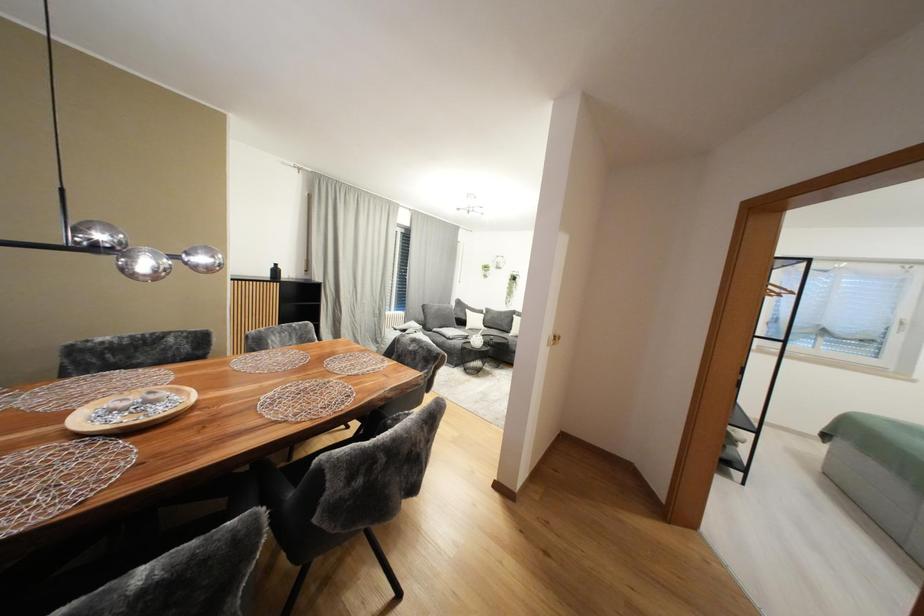
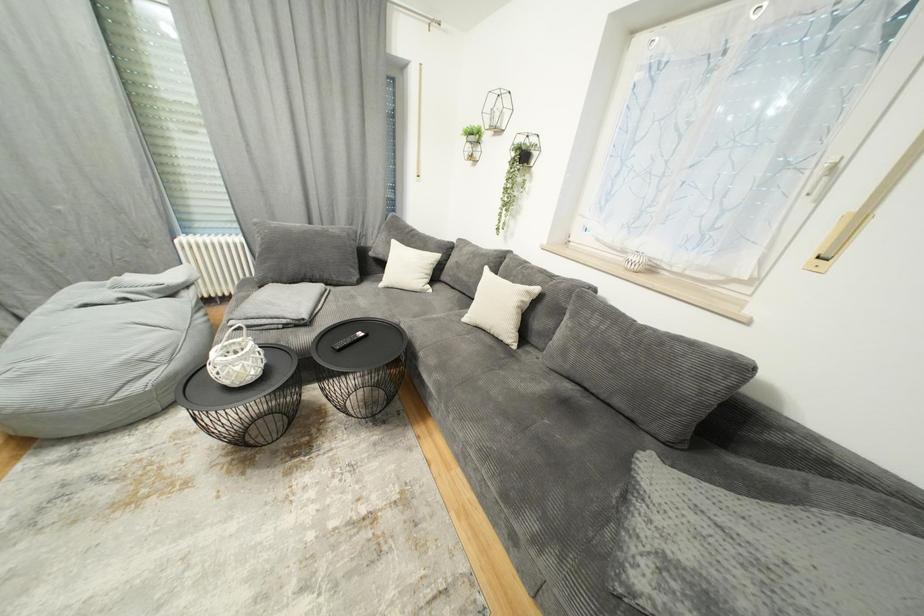
Which direction would the cameraman need to move to produce the second image?

The cameraman walked toward right, forward.